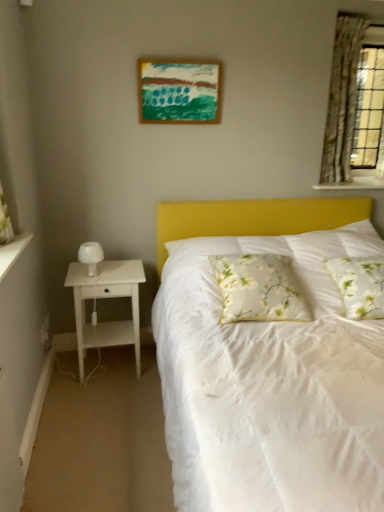
Question: From a real-world perspective, is white floral pillow at center, which is the 1th pillow from left to right, positioned under white textured shelf at upper right based on gravity?

Choices:
 (A) yes
 (B) no

Answer: (A)

Question: Considering the relative positions of white floral pillow at center, marked as the second pillow in a right-to-left arrangement, and white textured shelf at upper right in the image provided, is white floral pillow at center, marked as the second pillow in a right-to-left arrangement, in front of white textured shelf at upper right?

Choices:
 (A) no
 (B) yes

Answer: (B)

Question: Does white floral pillow at center, marked as the second pillow in a right-to-left arrangement, have a greater height compared to white textured shelf at upper right?

Choices:
 (A) yes
 (B) no

Answer: (A)

Question: Is the position of white floral pillow at center, which is the 1th pillow from left to right, more distant than that of white textured shelf at upper right?

Choices:
 (A) no
 (B) yes

Answer: (A)

Question: Can you confirm if white floral pillow at center, marked as the second pillow in a right-to-left arrangement, is shorter than white textured shelf at upper right?

Choices:
 (A) no
 (B) yes

Answer: (A)

Question: Is white floral pillow at center, marked as the second pillow in a right-to-left arrangement, positioned with its back to white textured shelf at upper right?

Choices:
 (A) no
 (B) yes

Answer: (A)

Question: Considering the relative positions of acrylic painting at upper center and white wood nightstand at left in the image provided, is acrylic painting at upper center in front of white wood nightstand at left?

Choices:
 (A) no
 (B) yes

Answer: (A)

Question: Considering the relative sizes of acrylic painting at upper center and white wood nightstand at left in the image provided, is acrylic painting at upper center shorter than white wood nightstand at left?

Choices:
 (A) yes
 (B) no

Answer: (A)

Question: Is acrylic painting at upper center facing towards white wood nightstand at left?

Choices:
 (A) yes
 (B) no

Answer: (B)

Question: Can you confirm if acrylic painting at upper center is bigger than white wood nightstand at left?

Choices:
 (A) yes
 (B) no

Answer: (B)

Question: Is acrylic painting at upper center at the left side of white wood nightstand at left?

Choices:
 (A) no
 (B) yes

Answer: (A)

Question: Is acrylic painting at upper center oriented away from white wood nightstand at left?

Choices:
 (A) yes
 (B) no

Answer: (B)

Question: Is white floral pillow at center, marked as the second pillow in a right-to-left arrangement, shorter than white matte table lamp at left?

Choices:
 (A) yes
 (B) no

Answer: (B)